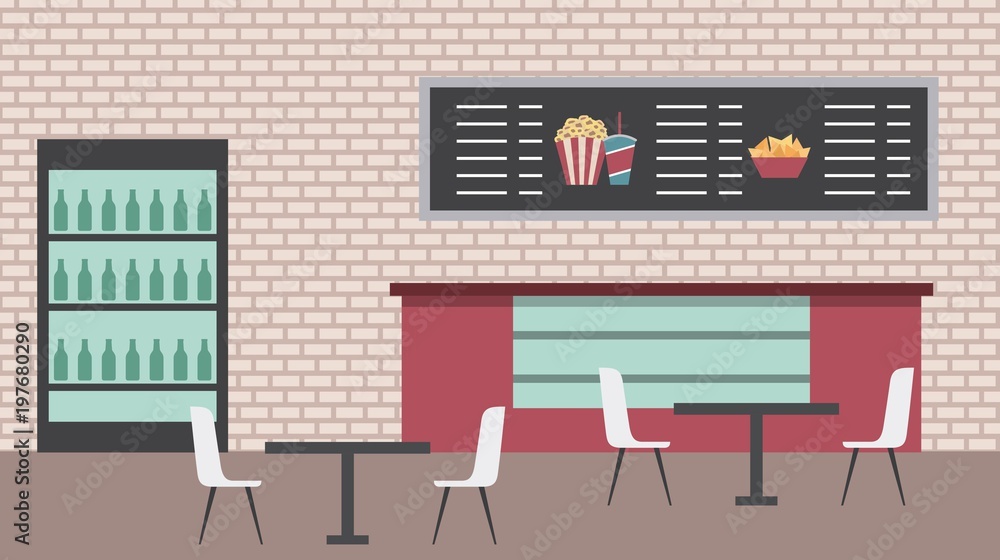
Locate an element on the screen. The width and height of the screenshot is (1000, 560). shelves is located at coordinates (168, 378), (165, 300), (144, 226).